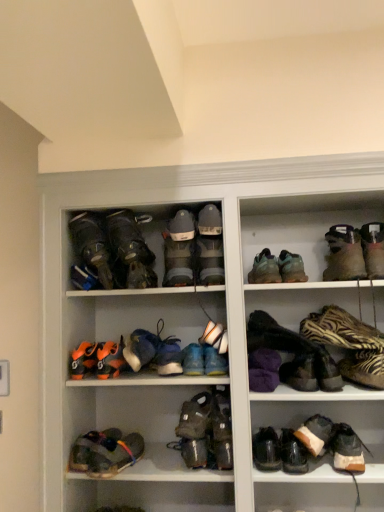
In order to face multicolored fabric sandal at lower left, marked as the sixteenth footwear in a right-to-left arrangement, should I rotate leftwards or rightwards?

You should look left and rotate roughly 10.138 degrees.

At what (x,y) coordinates should I click in order to perform the action: click on multicolored fabric sandal at lower left, acting as the fifth footwear starting from the left. Please return your answer as a coordinate pair (x, y). Looking at the image, I should click on (114, 454).

What do you see at coordinates (140, 348) in the screenshot? This screenshot has height=512, width=384. I see `blue suede sneaker at center` at bounding box center [140, 348].

At what (x,y) coordinates should I click in order to perform the action: click on brown suede boots at upper right, placed as the 2th footwear when sorted from right to left. Please return your answer as a coordinate pair (x, y). Image resolution: width=384 pixels, height=512 pixels. Looking at the image, I should click on (344, 254).

At what (x,y) coordinates should I click in order to perform the action: click on leather hiking boots at upper left, the 3th footwear positioned from the left. Please return your answer as a coordinate pair (x, y). This screenshot has height=512, width=384. Looking at the image, I should click on (92, 246).

Measure the distance between point (109, 265) and camera.

Point (109, 265) is 1.43 meters away from camera.

The image size is (384, 512). What are the coordinates of `leather/textured shoe at lower right, the 18th footwear from the left` in the screenshot? It's located at (317, 445).

Is leather hiking boots at upper left, the 3th footwear positioned from the left, to the left or to the right of dark gray suede boots at center, arranged as the tenth footwear when viewed from the left, in the image?

Based on their positions, leather hiking boots at upper left, the 3th footwear positioned from the left, is located to the left of dark gray suede boots at center, arranged as the tenth footwear when viewed from the left.

How many degrees apart are the facing directions of leather hiking boots at upper left, which is counted as the 18th footwear, starting from the right, and dark gray suede boots at center, the 11th footwear viewed from the right?

The facing directions of leather hiking boots at upper left, which is counted as the 18th footwear, starting from the right, and dark gray suede boots at center, the 11th footwear viewed from the right, are 13.7 degrees apart.

Is leather hiking boots at upper left, the 3th footwear positioned from the left, turned away from dark gray suede boots at center, the 11th footwear viewed from the right?

No, leather hiking boots at upper left, the 3th footwear positioned from the left, is not facing away from dark gray suede boots at center, the 11th footwear viewed from the right.

Between point (72, 234) and point (209, 267), which one is positioned behind?

The point (72, 234) is farther.

How different are the orientations of leather sneakers at lower left, the 2th footwear viewed from the left, and dark gray suede boots at center, arranged as the tenth footwear when viewed from the left, in degrees?

The angle between the facing direction of leather sneakers at lower left, the 2th footwear viewed from the left, and the facing direction of dark gray suede boots at center, arranged as the tenth footwear when viewed from the left, is 0.116 degrees.

Considering the sizes of objects leather sneakers at lower left, the 2th footwear viewed from the left, and dark gray suede boots at center, arranged as the tenth footwear when viewed from the left, in the image provided, who is smaller, leather sneakers at lower left, the 2th footwear viewed from the left, or dark gray suede boots at center, arranged as the tenth footwear when viewed from the left,?

Smaller between the two is leather sneakers at lower left, the 2th footwear viewed from the left.

Are leather sneakers at lower left, the 2th footwear viewed from the left, and dark gray suede boots at center, the 11th footwear viewed from the right, located far from each other?

leather sneakers at lower left, the 2th footwear viewed from the left, is actually quite close to dark gray suede boots at center, the 11th footwear viewed from the right.

Is leather sneakers at lower left, the 2th footwear viewed from the left, to the left or to the right of dark gray suede boots at center, the 11th footwear viewed from the right, in the image?

From the image, it's evident that leather sneakers at lower left, the 2th footwear viewed from the left, is to the left of dark gray suede boots at center, the 11th footwear viewed from the right.

Is blue suede sneaker at center to the left or to the right of purple fuzzy slippers at center, marked as the seventh footwear in a right-to-left arrangement, in the image?

blue suede sneaker at center is to the left of purple fuzzy slippers at center, marked as the seventh footwear in a right-to-left arrangement.

From the image's perspective, is blue suede sneaker at center beneath purple fuzzy slippers at center, the fourteenth footwear when ordered from left to right?

Incorrect, from the image's perspective, blue suede sneaker at center is higher than purple fuzzy slippers at center, the fourteenth footwear when ordered from left to right.

From a real-world perspective, is blue suede sneaker at center physically located above or below purple fuzzy slippers at center, the fourteenth footwear when ordered from left to right?

Clearly, from a real-world perspective, blue suede sneaker at center is above purple fuzzy slippers at center, the fourteenth footwear when ordered from left to right.

Find the location of `the 4th footwear directly above the leather/textured shoe at lower right, the third footwear from the right (from a real-world perspective)`. the 4th footwear directly above the leather/textured shoe at lower right, the third footwear from the right (from a real-world perspective) is located at coordinates (214, 361).

Is blue suede sneakers at center, the 9th footwear from the right, not close to leather/textured shoe at lower right, the third footwear from the right?

No, blue suede sneakers at center, the 9th footwear from the right, is in close proximity to leather/textured shoe at lower right, the third footwear from the right.

Consider the image. Considering the sizes of blue suede sneakers at center, which appears as the twelfth footwear when viewed from the left, and leather/textured shoe at lower right, the 18th footwear from the left, in the image, is blue suede sneakers at center, which appears as the twelfth footwear when viewed from the left, wider or thinner than leather/textured shoe at lower right, the 18th footwear from the left,?

In the image, blue suede sneakers at center, which appears as the twelfth footwear when viewed from the left, appears to be more narrow than leather/textured shoe at lower right, the 18th footwear from the left.

Between point (205, 346) and point (341, 426), which one is positioned behind?

The point (341, 426) is farther from the camera.

Considering the sizes of objects blue suede sneaker at center and blue suede sneakers at center, which ranks as the sixth footwear in left-to-right order, in the image provided, who is bigger, blue suede sneaker at center or blue suede sneakers at center, which ranks as the sixth footwear in left-to-right order,?

blue suede sneaker at center.

Are blue suede sneaker at center and blue suede sneakers at center, marked as the fifteenth footwear in a right-to-left arrangement, located far from each other?

blue suede sneaker at center is near blue suede sneakers at center, marked as the fifteenth footwear in a right-to-left arrangement, not far away.

Is the position of blue suede sneaker at center more distant than that of blue suede sneakers at center, marked as the fifteenth footwear in a right-to-left arrangement?

That is True.

Is blue suede sneakers at center, marked as the fifteenth footwear in a right-to-left arrangement, at the back of blue suede sneaker at center?

That's not correct — blue suede sneaker at center is not looking away from blue suede sneakers at center, marked as the fifteenth footwear in a right-to-left arrangement.

Which object is closer to the camera taking this photo, multicolored fabric sandal at lower left, acting as the fifth footwear starting from the left, or leather boot at lower right, which appears as the 4th footwear when viewed from the right?

multicolored fabric sandal at lower left, acting as the fifth footwear starting from the left.

This screenshot has width=384, height=512. I want to click on footwear that is the 2nd one above the leather boot at lower right, the seventeenth footwear when ordered from left to right (from a real-world perspective), so click(x=114, y=454).

In terms of size, does multicolored fabric sandal at lower left, marked as the sixteenth footwear in a right-to-left arrangement, appear bigger or smaller than leather boot at lower right, which appears as the 4th footwear when viewed from the right?

multicolored fabric sandal at lower left, marked as the sixteenth footwear in a right-to-left arrangement, is smaller than leather boot at lower right, which appears as the 4th footwear when viewed from the right.

Is leather sneakers at lower left, the nineteenth footwear when ordered from right to left, next to zebra-patterned fabric shoe at center-right, which ranks as the fifth footwear in right-to-left order?

No.

Considering the relative positions of leather sneakers at lower left, the nineteenth footwear when ordered from right to left, and zebra-patterned fabric shoe at center-right, the sixteenth footwear in the left-to-right sequence, in the image provided, is leather sneakers at lower left, the nineteenth footwear when ordered from right to left, to the right of zebra-patterned fabric shoe at center-right, the sixteenth footwear in the left-to-right sequence, from the viewer's perspective?

In fact, leather sneakers at lower left, the nineteenth footwear when ordered from right to left, is to the left of zebra-patterned fabric shoe at center-right, the sixteenth footwear in the left-to-right sequence.

From the image's perspective, starting from the leather hiking boots at upper left, which is counted as the 18th footwear, starting from the right, which footwear is the 2nd one above? Please provide its 2D coordinates.

[(209, 260)]

The height and width of the screenshot is (512, 384). What are the coordinates of `footwear that is the 19th object located below the dark gray suede boots at center, the 11th footwear viewed from the right (from the image's perspective)` in the screenshot? It's located at (92, 447).

When comparing their distances from blue suede sneakers at center, marked as the fifteenth footwear in a right-to-left arrangement, does zebra-patterned fabric shoe at center-right, the sixteenth footwear in the left-to-right sequence, or orange synthetic shoe at lower left, which is the 20th footwear in right-to-left order, seem closer?

orange synthetic shoe at lower left, which is the 20th footwear in right-to-left order, is positioned closer to the anchor blue suede sneakers at center, marked as the fifteenth footwear in a right-to-left arrangement.

Considering their positions, is zebra-patterned fabric shoe at center-right, which ranks as the fifth footwear in right-to-left order, positioned closer to orange synthetic shoe at lower left, which is the first footwear in left-to-right order, than multicolored fabric sandal at lower left, marked as the sixteenth footwear in a right-to-left arrangement?

Among the two, multicolored fabric sandal at lower left, marked as the sixteenth footwear in a right-to-left arrangement, is located nearer to orange synthetic shoe at lower left, which is the first footwear in left-to-right order.

Which object lies further to the anchor point leather/textured shoe at lower right, the 18th footwear from the left, leather boot at lower right, the seventeenth footwear when ordered from left to right, or brown suede shoe at lower right, which is counted as the first footwear, starting from the right?

leather boot at lower right, the seventeenth footwear when ordered from left to right, is further to leather/textured shoe at lower right, the 18th footwear from the left.

Based on their spatial positions, is zebra-patterned fabric shoe at center-right, the sixteenth footwear in the left-to-right sequence, or purple fuzzy slippers at center, the fourteenth footwear when ordered from left to right, closer to blue suede sneakers at center, which ranks as the sixth footwear in left-to-right order?

purple fuzzy slippers at center, the fourteenth footwear when ordered from left to right, is positioned closer to the anchor blue suede sneakers at center, which ranks as the sixth footwear in left-to-right order.

Which object lies nearer to the anchor point leather boot at lower right, the seventeenth footwear when ordered from left to right, white fabric shoe at center, the eleventh footwear when ordered from left to right, or matte brown boot at upper right, arranged as the sixth footwear when viewed from the right?

white fabric shoe at center, the eleventh footwear when ordered from left to right, is positioned closer to the anchor leather boot at lower right, the seventeenth footwear when ordered from left to right.

From the image, which object appears to be nearer to white fabric shoe at center, the tenth footwear positioned from the right, brown suede shoe at lower right, arranged as the 20th footwear when viewed from the left, or blue suede sneakers at center, which ranks as the sixth footwear in left-to-right order?

blue suede sneakers at center, which ranks as the sixth footwear in left-to-right order.

Estimate the real-world distances between objects in this image. Which object is closer to camouflage fabric boot at center, which is the 12th footwear in right-to-left order, matte brown boot at upper right, arranged as the sixth footwear when viewed from the right, or blue suede shoe at center, placed as the 8th footwear when sorted from left to right?

Based on the image, blue suede shoe at center, placed as the 8th footwear when sorted from left to right, appears to be nearer to camouflage fabric boot at center, which is the 12th footwear in right-to-left order.

Considering their positions, is matte gray boots at center, marked as the fourteenth footwear in a right-to-left arrangement, positioned further to camouflage fabric boot at center, which ranks as the ninth footwear in left-to-right order, than dark gray suede boots at center, the 11th footwear viewed from the right?

matte gray boots at center, marked as the fourteenth footwear in a right-to-left arrangement, is further to camouflage fabric boot at center, which ranks as the ninth footwear in left-to-right order.

Locate an element on the screen. shoe between dark gray suede boots at center, arranged as the tenth footwear when viewed from the left, and purple fuzzy slippers at center, marked as the seventh footwear in a right-to-left arrangement, from top to bottom is located at coordinates (140, 348).

Identify the location of shoe between leather sneakers at lower left, the 2th footwear viewed from the left, and leather boot at lower right, the seventeenth footwear when ordered from left to right. Image resolution: width=384 pixels, height=512 pixels. (140, 348).

Find the location of `shoe between dark gray suede boots at center, arranged as the tenth footwear when viewed from the left, and camouflage fabric boot at center, the 13th footwear when ordered from left to right, in the vertical direction`. shoe between dark gray suede boots at center, arranged as the tenth footwear when viewed from the left, and camouflage fabric boot at center, the 13th footwear when ordered from left to right, in the vertical direction is located at coordinates (140, 348).

I want to click on shoe located between leather hiking boots at upper left, which is counted as the 18th footwear, starting from the right, and zebra-patterned fabric shoe at center-right, which ranks as the fifth footwear in right-to-left order, in the left-right direction, so click(x=140, y=348).